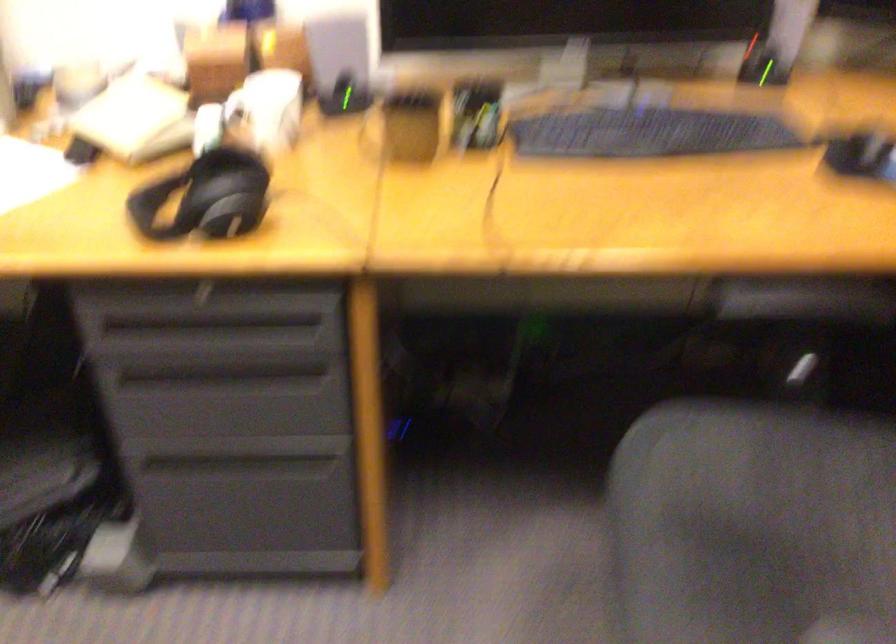
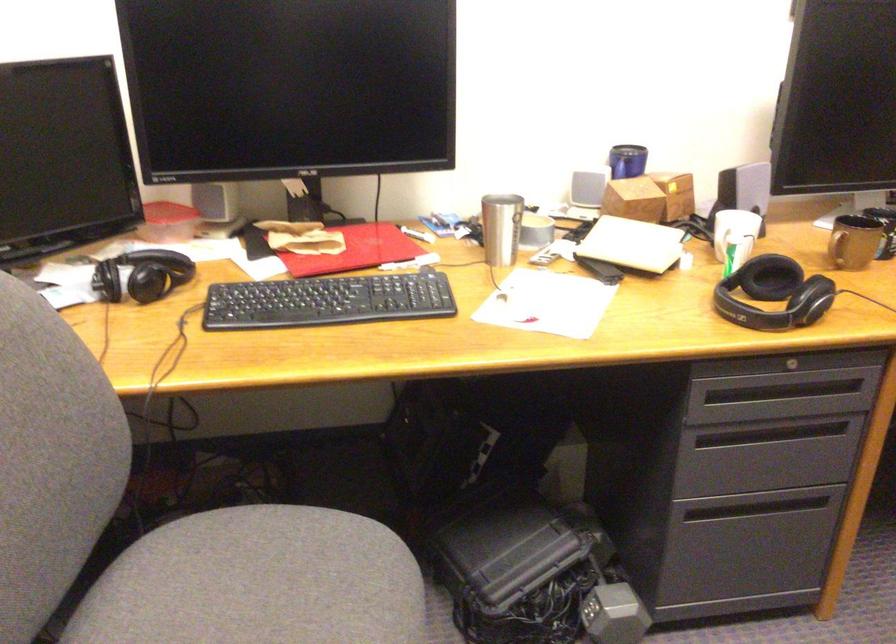
Find the pixel in the second image that matches point 229,301 in the first image.

(794, 365)